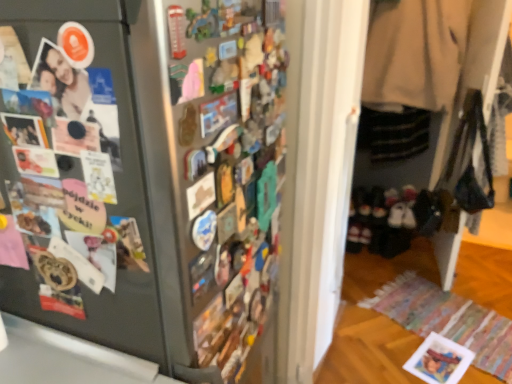
Question: From the image's perspective, would you say black suede shoes at lower right is shown under beige wool coat at right?

Choices:
 (A) no
 (B) yes

Answer: (B)

Question: Can you confirm if black suede shoes at lower right is positioned to the right of beige wool coat at right?

Choices:
 (A) no
 (B) yes

Answer: (A)

Question: Can you confirm if black suede shoes at lower right is bigger than beige wool coat at right?

Choices:
 (A) yes
 (B) no

Answer: (B)

Question: Is black suede shoes at lower right beside beige wool coat at right?

Choices:
 (A) no
 (B) yes

Answer: (A)

Question: Is black suede shoes at lower right looking in the opposite direction of beige wool coat at right?

Choices:
 (A) no
 (B) yes

Answer: (A)

Question: Is black suede shoes at lower right to the left of beige wool coat at right from the viewer's perspective?

Choices:
 (A) no
 (B) yes

Answer: (B)

Question: From a real-world perspective, does satin black fridge at left stand above black suede shoes at lower right?

Choices:
 (A) no
 (B) yes

Answer: (B)

Question: Considering the relative sizes of satin black fridge at left and black suede shoes at lower right in the image provided, is satin black fridge at left smaller than black suede shoes at lower right?

Choices:
 (A) yes
 (B) no

Answer: (B)

Question: Is satin black fridge at left closer to the viewer compared to black suede shoes at lower right?

Choices:
 (A) no
 (B) yes

Answer: (B)

Question: Considering the relative sizes of satin black fridge at left and black suede shoes at lower right in the image provided, is satin black fridge at left taller than black suede shoes at lower right?

Choices:
 (A) no
 (B) yes

Answer: (B)

Question: From the image's perspective, is satin black fridge at left under black suede shoes at lower right?

Choices:
 (A) yes
 (B) no

Answer: (A)

Question: Would you say satin black fridge at left is a long distance from black suede shoes at lower right?

Choices:
 (A) no
 (B) yes

Answer: (B)

Question: Can you confirm if satin black fridge at left is bigger than matte black photo at left?

Choices:
 (A) yes
 (B) no

Answer: (A)